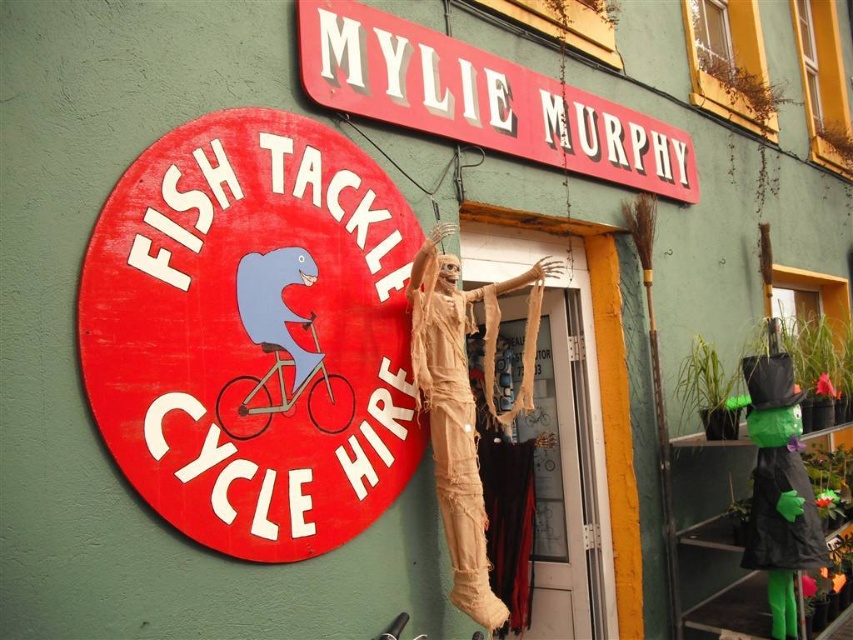
Question: Which is farther from the beige fabric mummy at center?

Choices:
 (A) wooden fish tackle cycle hire sign at left
 (B) red plastic sign at upper center

Answer: (B)

Question: Among these points, which one is nearest to the camera?

Choices:
 (A) (218, 250)
 (B) (584, 138)

Answer: (A)

Question: Does wooden fish tackle cycle hire sign at left appear over red plastic sign at upper center?

Choices:
 (A) yes
 (B) no

Answer: (B)

Question: Considering the real-world distances, which object is closest to the beige fabric mummy at center?

Choices:
 (A) red plastic sign at upper center
 (B) wooden fish tackle cycle hire sign at left

Answer: (B)

Question: Is wooden fish tackle cycle hire sign at left above beige fabric mummy at center?

Choices:
 (A) yes
 (B) no

Answer: (A)

Question: Considering the relative positions of red plastic sign at upper center and beige fabric mummy at center in the image provided, where is red plastic sign at upper center located with respect to beige fabric mummy at center?

Choices:
 (A) above
 (B) below

Answer: (A)